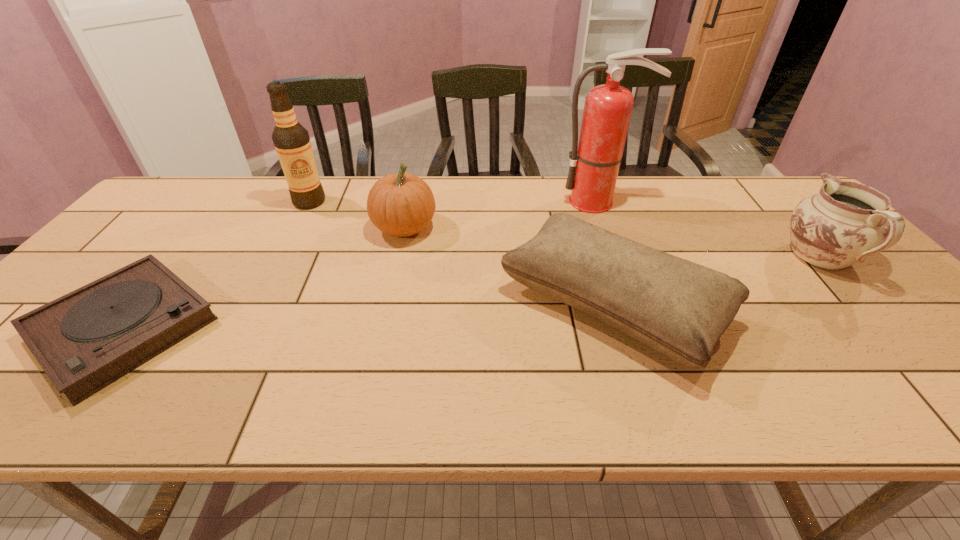
Identify the location of free space at the left edge. (159, 257).

The width and height of the screenshot is (960, 540). I want to click on free point between the second tallest object and the pumpkin, so click(x=357, y=215).

Identify the location of empty space between the alcohol and the fifth tallest object. This screenshot has width=960, height=540. (462, 253).

Locate an element on the screen. vacant area between the fourth object from right to left and the fifth shortest object is located at coordinates (357, 215).

Locate which object is the fifth closest to the tallest object. Please provide its 2D coordinates. Your answer should be formatted as a tuple, i.e. [(x, y)], where the tuple contains the x and y coordinates of a point satisfying the conditions above.

[(84, 341)]

Locate an element on the screen. object that is the fifth nearest to the fifth tallest object is located at coordinates [84, 341].

Find the location of a particular element. vacant space that satisfies the following two spatial constraints: 1. on the spout of the pitcher; 2. on the stem of the pumpkin is located at coordinates (794, 228).

Locate an element on the screen. This screenshot has width=960, height=540. free space that satisfies the following two spatial constraints: 1. on the back side of the fifth tallest object; 2. on the stem of the pumpkin is located at coordinates [x=589, y=228].

The image size is (960, 540). I want to click on free space that satisfies the following two spatial constraints: 1. with the handle and hose on the fire extinguisher; 2. on the stem of the fourth object from right to left, so click(607, 228).

Locate an element on the screen. free space that satisfies the following two spatial constraints: 1. with the handle and hose on the tallest object; 2. on the stem of the third object from left to right is located at coordinates (607, 228).